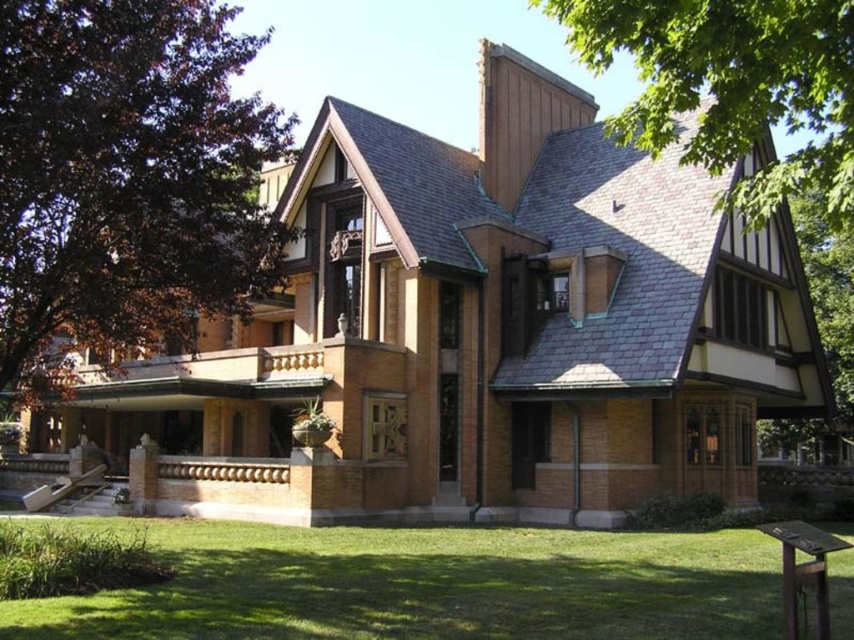
Does dark brown wood at upper left lie behind green grass at lower center?

Yes, dark brown wood at upper left is further from the viewer.

From the picture: Is dark brown wood at upper left above green grass at lower center?

Correct, dark brown wood at upper left is located above green grass at lower center.

Locate an element on the screen. The width and height of the screenshot is (854, 640). dark brown wood at upper left is located at coordinates (126, 180).

Can you confirm if dark brown wood at upper left is positioned above green leafy tree at upper right?

No.

Locate an element on the screen. dark brown wood at upper left is located at coordinates (126, 180).

Locate an element on the screen. The height and width of the screenshot is (640, 854). dark brown wood at upper left is located at coordinates (126, 180).

Image resolution: width=854 pixels, height=640 pixels. I want to click on dark brown wood at upper left, so click(x=126, y=180).

Can you confirm if green grass at lower center is thinner than green leafy tree at upper right?

Indeed, green grass at lower center has a lesser width compared to green leafy tree at upper right.

Is green grass at lower center to the left of green leafy tree at upper right from the viewer's perspective?

Yes, green grass at lower center is to the left of green leafy tree at upper right.

What do you see at coordinates (425, 586) in the screenshot?
I see `green grass at lower center` at bounding box center [425, 586].

Identify the location of green grass at lower center. This screenshot has height=640, width=854. (425, 586).